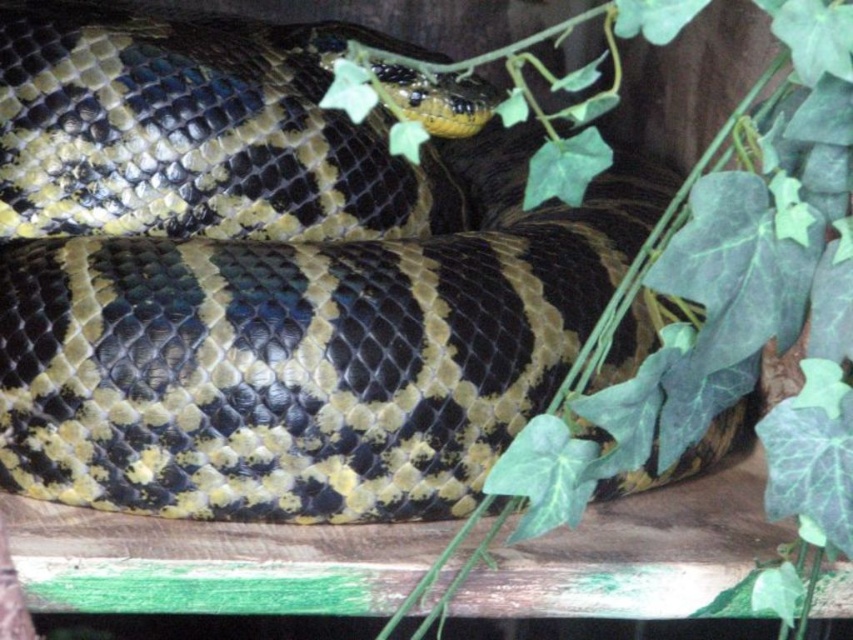
Question: Does yellow-green scales at center appear under green leafy vine at upper center?

Choices:
 (A) no
 (B) yes

Answer: (A)

Question: Can you confirm if yellow-green scales at center is wider than green leafy vine at upper center?

Choices:
 (A) no
 (B) yes

Answer: (B)

Question: Does yellow-green scales at center have a larger size compared to green leafy vine at upper center?

Choices:
 (A) no
 (B) yes

Answer: (B)

Question: Which point appears closest to the camera in this image?

Choices:
 (A) (0, 241)
 (B) (798, 460)

Answer: (B)

Question: Which object appears farthest from the camera in this image?

Choices:
 (A) green leafy vine at upper center
 (B) yellow-green scales at center

Answer: (B)

Question: Which point is farther to the camera?

Choices:
 (A) (25, 179)
 (B) (785, 292)

Answer: (A)